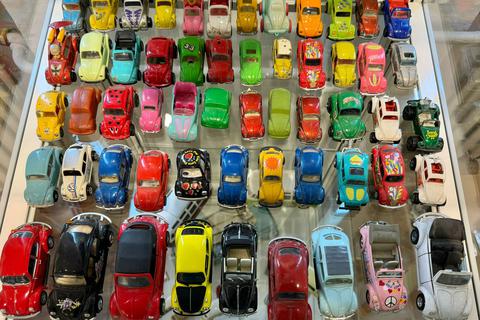
Where is `toy car in bottom row`? toy car in bottom row is located at coordinates (30, 269), (72, 276), (126, 271), (192, 270), (239, 274), (280, 278), (335, 280), (389, 269), (455, 270).